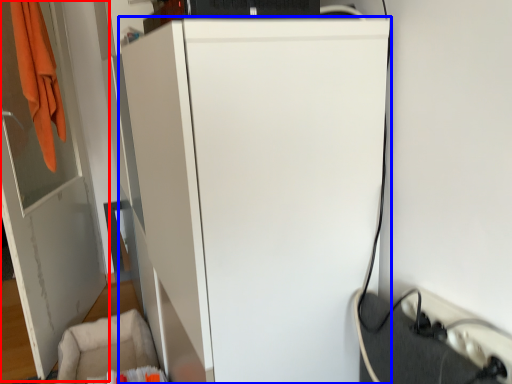
Question: Which object is closer to the camera taking this photo, door (highlighted by a red box) or refrigerator (highlighted by a blue box)?

Choices:
 (A) door
 (B) refrigerator

Answer: (B)